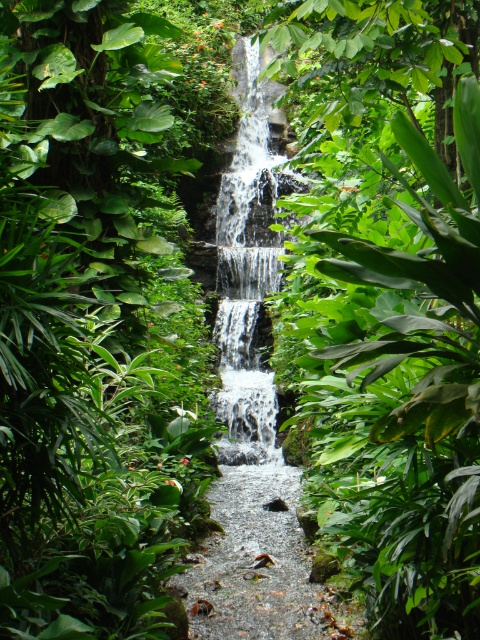
Based on the photo, you are standing at the entrance of the tropical garden and want to reach the waterfall. There is a smooth gravel path at center. Based on the coordinates provided, is the path located to the left or right of the waterfall?

The smooth gravel path at center is located at coordinates point (259,564), which places it to the right of the waterfall.

You are a gardener planning to install a new irrigation system. You need to place a water sensor on the smooth gravel path at center and a moisture sensor on the white frothy water at center. Which sensor should you place first to ensure proper functionality?

The smooth gravel path at center is located below the white frothy water at center. Therefore, you should place the moisture sensor on the white frothy water at center first to ensure it is above the water sensor on the path below.

You are standing in the tropical garden and want to place a small statue between the two points, point (261, 486) and point (249, 264). Which point should the statue be closer to if you want it to be nearer to the waterfall?

The statue should be placed closer to point (261, 486) because it is closer to the viewer, which likely places it nearer to the waterfall in the scene.